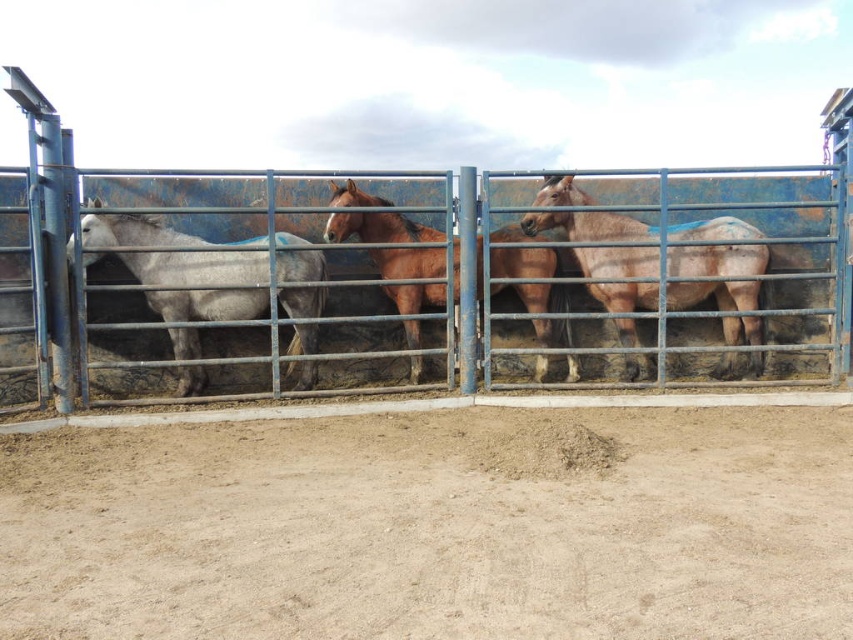
You are a visitor standing in front of the blue metal fence at center and looking at the gray matte horse at left. Which object is closer to you?

The blue metal fence at center is closer to you than the gray matte horse at left because it is positioned further away behind the fence.

You are a veterinarian examining two horses in a paddock. The brown matte horse at center and the brown glossy horse at center are both standing behind a metal gate. How far apart are these two horses from each other?

The brown matte horse at center is 32.13 inches from brown glossy horse at center.

You are a visitor at the horse enclosure and want to take a photo of the gray matte horse at left without the blue metal fence at center blocking the view. Is this possible from your current position?

The blue metal fence at center is positioned over the gray matte horse at left, so taking a photo without the fence blocking the view from your current position is not possible.